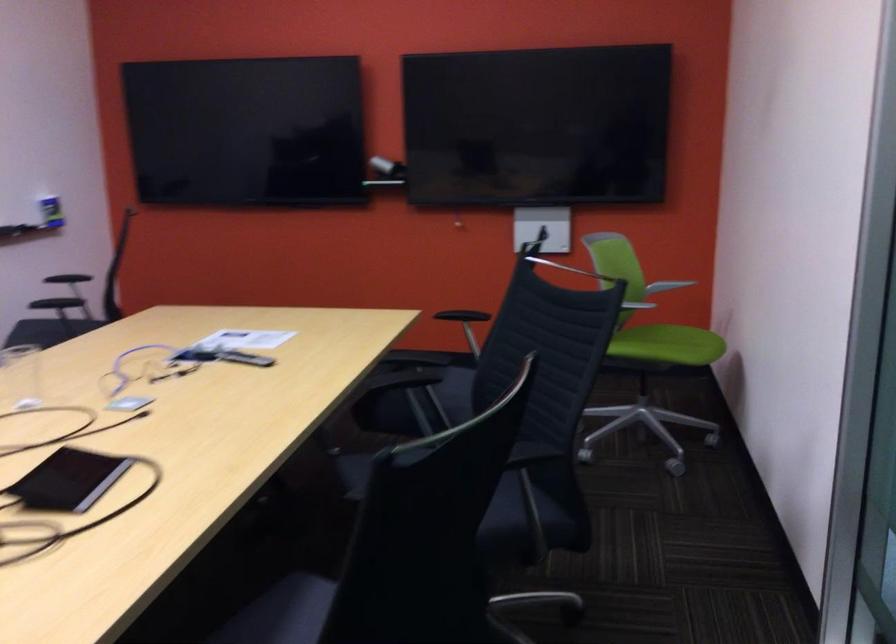
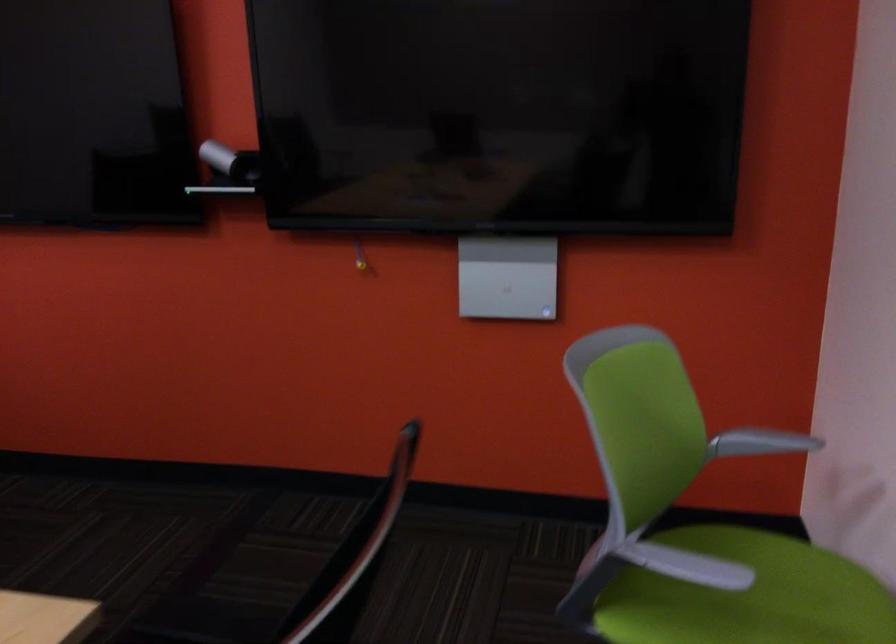
Locate, in the second image, the point that corresponds to [666,337] in the first image.

(747, 596)